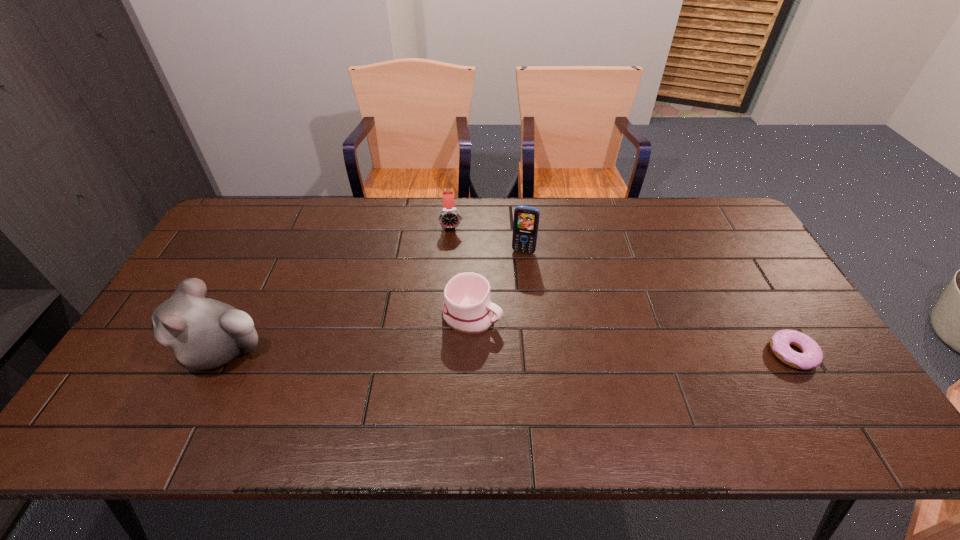
I want to click on doughnut at the near edge, so click(x=811, y=357).

Locate an element on the screen. The image size is (960, 540). object located at the left edge is located at coordinates (203, 333).

The width and height of the screenshot is (960, 540). Identify the location of object located in the right edge section of the desktop. (811, 357).

Where is `object that is at the near left corner`? The height and width of the screenshot is (540, 960). object that is at the near left corner is located at coordinates (203, 333).

Identify the location of object at the near right corner. The width and height of the screenshot is (960, 540). (811, 357).

The image size is (960, 540). I want to click on blank space at the far edge of the desktop, so click(x=600, y=233).

Identify the location of vacant space at the near edge of the desktop. The height and width of the screenshot is (540, 960). click(x=537, y=393).

The width and height of the screenshot is (960, 540). In the image, there is a desktop. In order to click on vacant space at the left edge in this screenshot , I will do `click(214, 254)`.

The height and width of the screenshot is (540, 960). Find the location of `vacant space at the right edge`. vacant space at the right edge is located at coordinates (761, 264).

Find the location of a particular element. The image size is (960, 540). free space at the far right corner of the desktop is located at coordinates (710, 220).